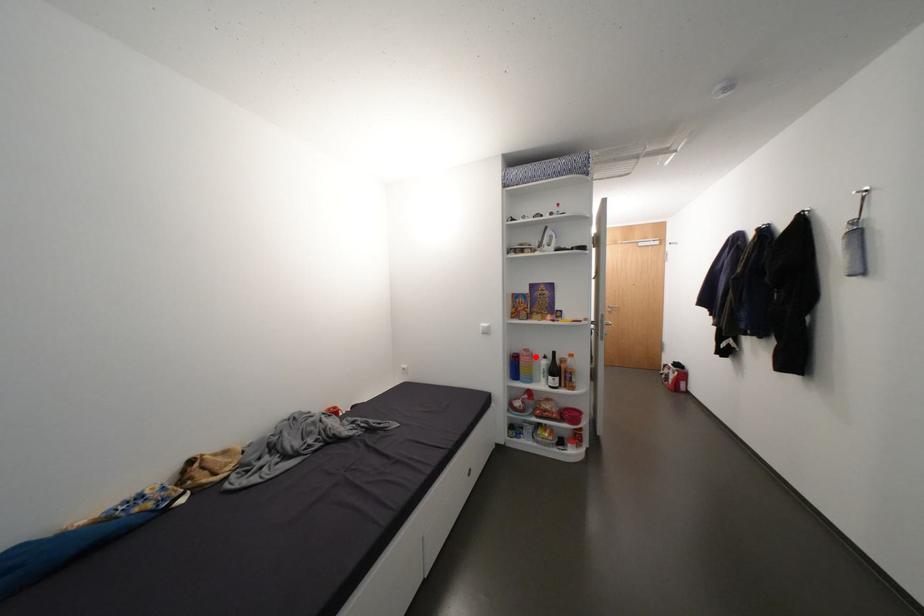
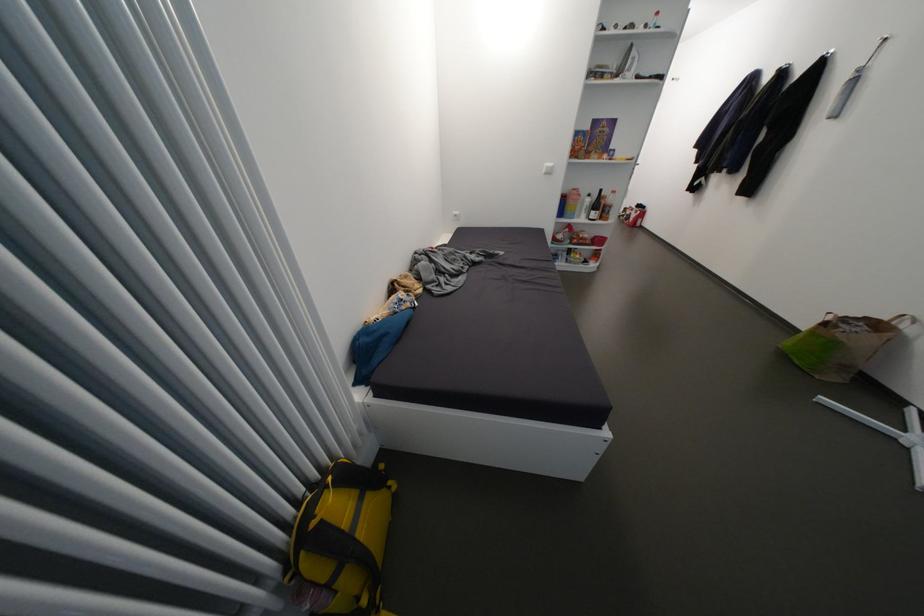
Question: I am providing you with two images of the same scene from different viewpoints. In image1, a red point is highlighted. Considering the same 3D point in image2, which of the following is correct?

Choices:
 (A) It is closer
 (B) It is farther

Answer: (A)